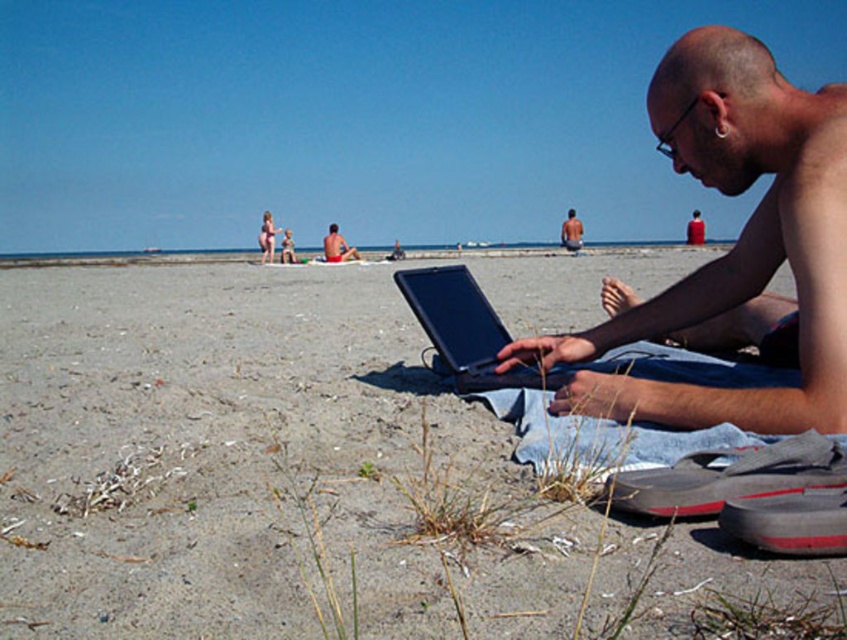
Question: Is shiny black laptop at center closer to the viewer compared to shiny black laptop at lower right?

Choices:
 (A) no
 (B) yes

Answer: (B)

Question: Considering the real-world distances, which object is closest to the black matte laptop at center?

Choices:
 (A) shiny black laptop at center
 (B) red swim trunks at center

Answer: (A)

Question: Where is shiny black laptop at center located in relation to red swim trunks at center in the image?

Choices:
 (A) left
 (B) right

Answer: (B)

Question: Estimate the real-world distances between objects in this image. Which object is closer to the black matte laptop at center?

Choices:
 (A) shiny black laptop at lower right
 (B) gray sand at lower center
 (C) smooth skin man at center
 (D) shiny black laptop at center

Answer: (D)

Question: Among these points, which one is farthest from the camera?

Choices:
 (A) (341, 243)
 (B) (455, 282)
 (C) (693, 218)

Answer: (C)

Question: Does shiny black laptop at center have a smaller size compared to smooth skin man at center?

Choices:
 (A) yes
 (B) no

Answer: (B)